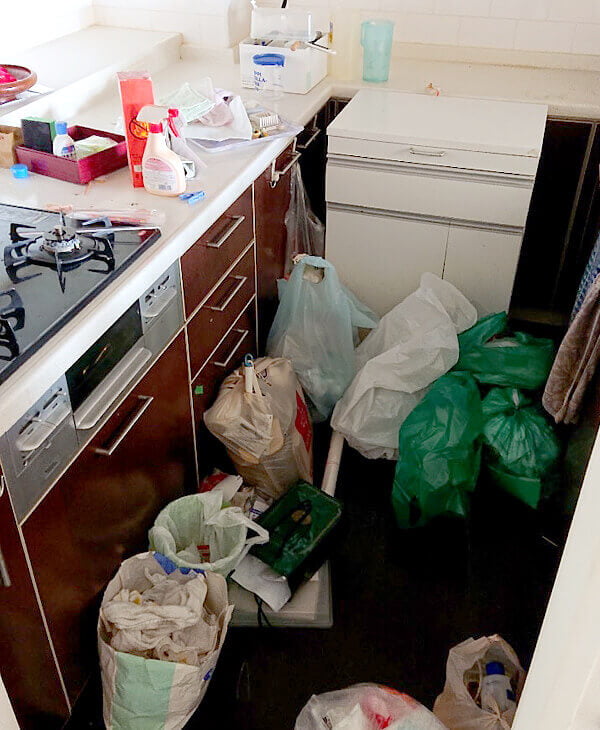
This screenshot has height=730, width=600. I want to click on aluminium handle, so click(218, 241).